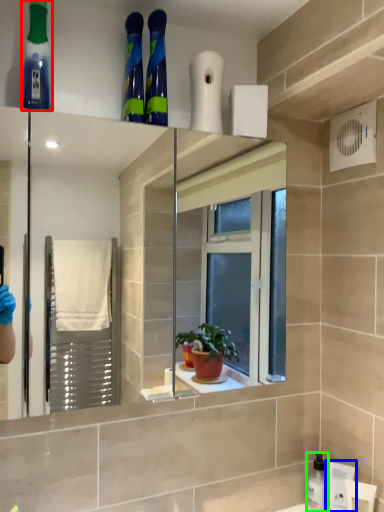
Question: Which object is positioned farthest from mouthwash (highlighted by a red box)? Select from toiletry (highlighted by a blue box) and cleaning product (highlighted by a green box).

Choices:
 (A) toiletry
 (B) cleaning product

Answer: (B)